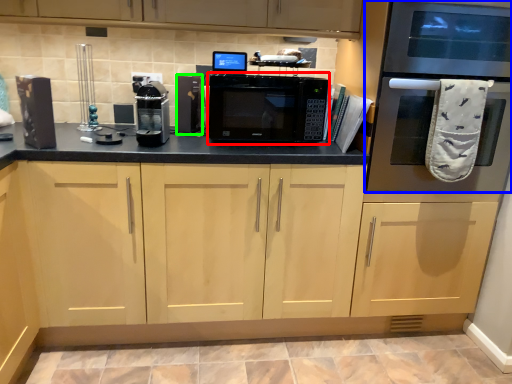
Question: Considering the real-world distances, which object is closest to microwave oven (highlighted by a red box)? oven (highlighted by a blue box) or appliance (highlighted by a green box).

Choices:
 (A) oven
 (B) appliance

Answer: (B)